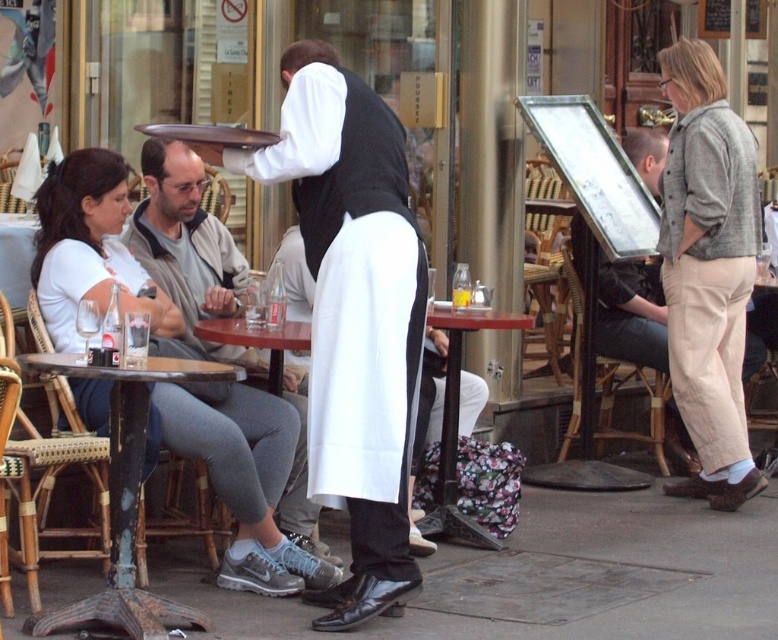
Measure the distance between rustic wood table at lower left and camera.

A distance of 5.30 meters exists between rustic wood table at lower left and camera.

Does rustic wood table at lower left appear on the left side of translucent glass at table center?

Indeed, rustic wood table at lower left is positioned on the left side of translucent glass at table center.

Where is `rustic wood table at lower left`? This screenshot has width=778, height=640. rustic wood table at lower left is located at coordinates (124, 500).

Is matte gray jacket at left bigger than translucent glass at table center?

Yes.

Measure the distance between matte gray jacket at left and camera.

matte gray jacket at left and camera are 21.32 feet apart from each other.

Which is in front, point (303, 444) or point (451, 301)?

Positioned in front is point (303, 444).

At what (x,y) coordinates should I click in order to perform the action: click on matte gray jacket at left. Please return your answer as a coordinate pair (x, y). Looking at the image, I should click on (188, 248).

Who is positioned more to the left, matte gray jacket at left or wooden table at center?

Positioned to the left is matte gray jacket at left.

Is matte gray jacket at left positioned behind wooden table at center?

No, matte gray jacket at left is closer to the viewer.

Image resolution: width=778 pixels, height=640 pixels. Describe the element at coordinates (188, 248) in the screenshot. I see `matte gray jacket at left` at that location.

Where is `matte gray jacket at left`? The height and width of the screenshot is (640, 778). matte gray jacket at left is located at coordinates (188, 248).